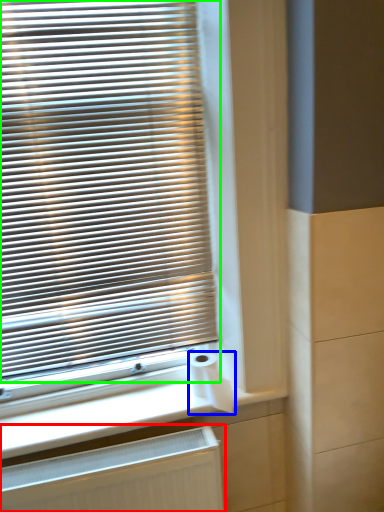
Question: Which object is the farthest from radiator (highlighted by a red box)? Choose among these: toilet paper (highlighted by a blue box) or window blind (highlighted by a green box).

Choices:
 (A) toilet paper
 (B) window blind

Answer: (B)